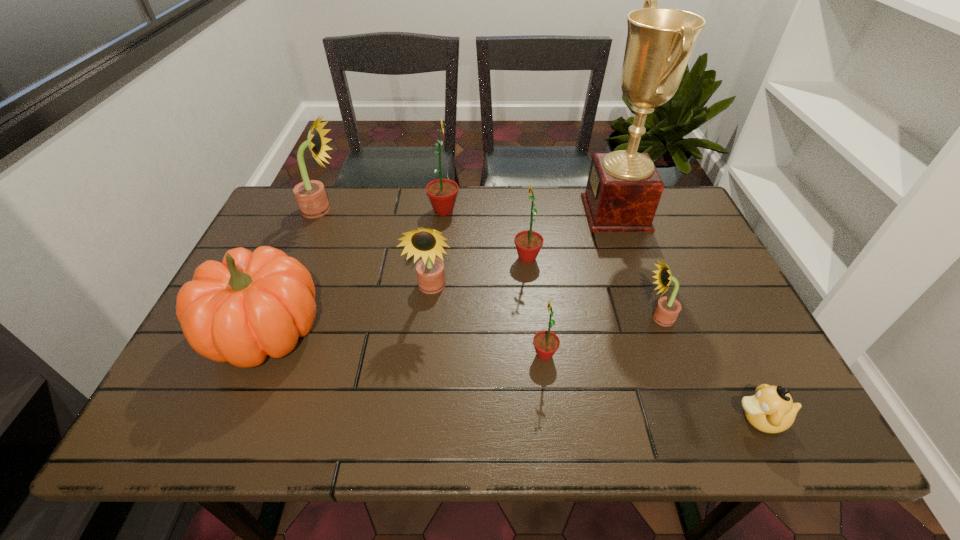
Where is `vacant space located 0.370m on the face of the leftmost green sunflower`? This screenshot has height=540, width=960. vacant space located 0.370m on the face of the leftmost green sunflower is located at coordinates (579, 211).

I want to click on vacant space located on the right of the pumpkin, so click(419, 332).

The width and height of the screenshot is (960, 540). I want to click on vacant space located 0.400m on the face of the fourth farthest object, so click(x=368, y=258).

Find the location of `vacant space located 0.240m on the face of the fourth farthest object`. vacant space located 0.240m on the face of the fourth farthest object is located at coordinates (426, 258).

Find the location of a particular element. vacant area situated on the face of the fourth farthest object is located at coordinates (466, 258).

Where is `vacant space located 0.070m on the face of the second biggest yellow sunflower`? vacant space located 0.070m on the face of the second biggest yellow sunflower is located at coordinates (427, 326).

This screenshot has height=540, width=960. I want to click on free space located on the face of the rightmost yellow sunflower, so [490, 318].

This screenshot has height=540, width=960. Identify the location of free space located on the face of the rightmost yellow sunflower. (527, 318).

The image size is (960, 540). In order to click on vacant space positioned 0.150m on the face of the rightmost yellow sunflower in this screenshot , I will do `click(581, 318)`.

Where is `vacant space situated on the face of the nearest sunflower`? This screenshot has height=540, width=960. vacant space situated on the face of the nearest sunflower is located at coordinates (420, 355).